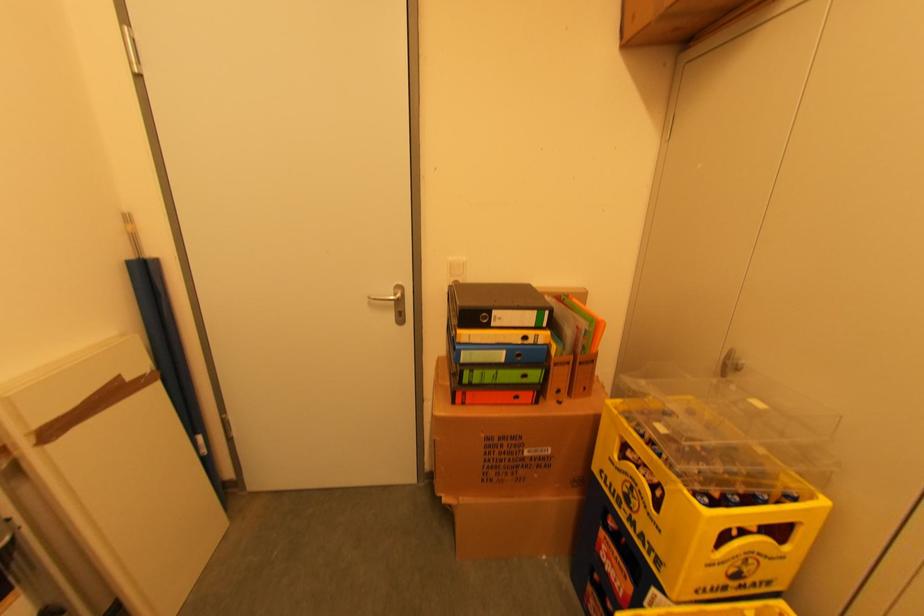
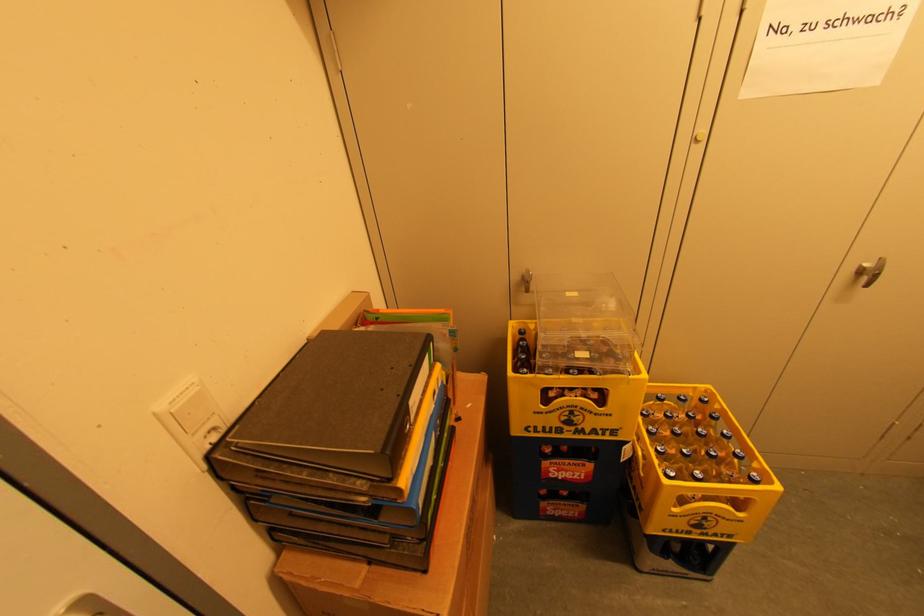
Based on the continuous images, in which direction is the camera rotating?

The camera's rotation is toward right-down.